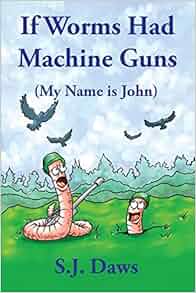
I want to click on book, so click(x=101, y=136).